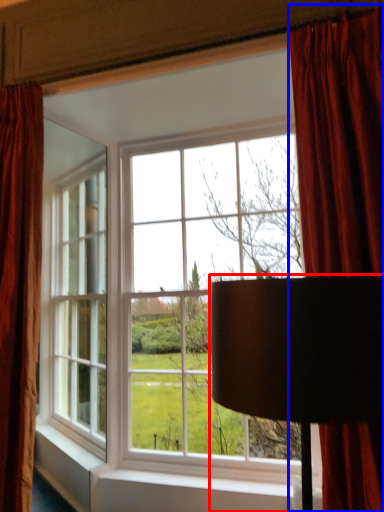
Question: Which point is closer to the camera, table lamp (highlighted by a red box) or curtain (highlighted by a blue box)?

Choices:
 (A) table lamp
 (B) curtain

Answer: (A)